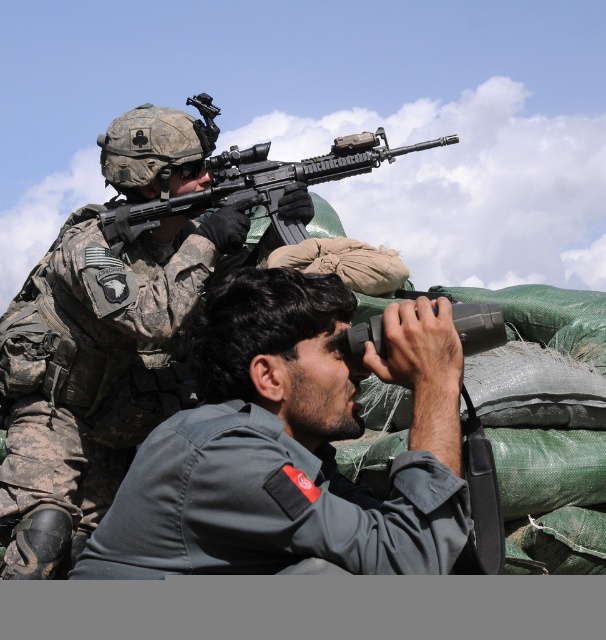
Does gray fabric binoculars at center appear on the right side of matte black rifle at upper center?

Incorrect, gray fabric binoculars at center is not on the right side of matte black rifle at upper center.

Does gray fabric binoculars at center have a lesser height compared to matte black rifle at upper center?

Incorrect, gray fabric binoculars at center's height does not fall short of matte black rifle at upper center's.

This screenshot has height=640, width=606. Describe the element at coordinates (291, 444) in the screenshot. I see `gray fabric binoculars at center` at that location.

Image resolution: width=606 pixels, height=640 pixels. In order to click on gray fabric binoculars at center in this screenshot , I will do `click(291, 444)`.

Does matte black rifle at upper center have a greater width compared to black rubber binoculars at center?

Indeed, matte black rifle at upper center has a greater width compared to black rubber binoculars at center.

Is point (382, 136) more distant than point (467, 308)?

Yes, it is behind point (467, 308).

Where is `matte black rifle at upper center`? The height and width of the screenshot is (640, 606). matte black rifle at upper center is located at coordinates (256, 184).

Does gray fabric binoculars at center have a larger size compared to black rubber binoculars at center?

Indeed, gray fabric binoculars at center has a larger size compared to black rubber binoculars at center.

Can you confirm if gray fabric binoculars at center is taller than black rubber binoculars at center?

Indeed, gray fabric binoculars at center has a greater height compared to black rubber binoculars at center.

Identify the location of gray fabric binoculars at center. The width and height of the screenshot is (606, 640). (291, 444).